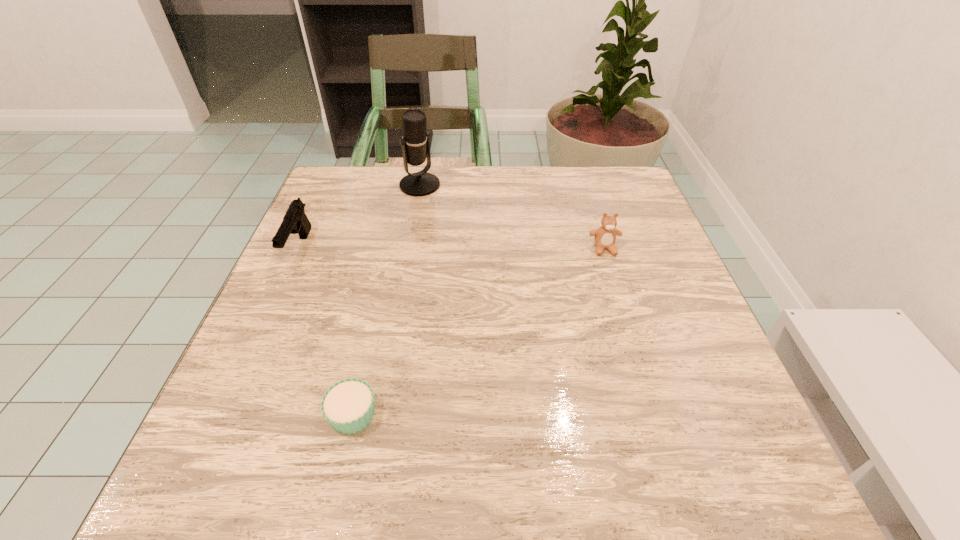
Where is `vacant space in between the leftmost object and the microphone`? This screenshot has height=540, width=960. vacant space in between the leftmost object and the microphone is located at coordinates (360, 217).

You are a GUI agent. You are given a task and a screenshot of the screen. Output one action in this format:
    pyautogui.click(x=<x>, y=<y>)
    Task: Click on the free area in between the teddy bear and the leftmost object
    This screenshot has width=960, height=540.
    Given the screenshot: What is the action you would take?
    pyautogui.click(x=452, y=248)

Locate an element on the screen. The height and width of the screenshot is (540, 960). empty space that is in between the pistol and the rightmost object is located at coordinates (452, 248).

Where is `vacant space that is in between the teddy bear and the farthest object`? The height and width of the screenshot is (540, 960). vacant space that is in between the teddy bear and the farthest object is located at coordinates (512, 217).

Image resolution: width=960 pixels, height=540 pixels. Identify the location of vacant area between the cupcake and the microphone. (386, 300).

In order to click on free space between the rightmost object and the cupcake in this screenshot , I will do `click(478, 331)`.

Where is `empty space that is in between the nearest object and the pistol`? This screenshot has width=960, height=540. empty space that is in between the nearest object and the pistol is located at coordinates (326, 330).

Locate an element on the screen. This screenshot has height=540, width=960. blank region between the teddy bear and the nearest object is located at coordinates (478, 331).

Identify the location of free space between the farthest object and the pistol. (360, 217).

Find the location of a particular element. The height and width of the screenshot is (540, 960). free area in between the pistol and the microphone is located at coordinates (360, 217).